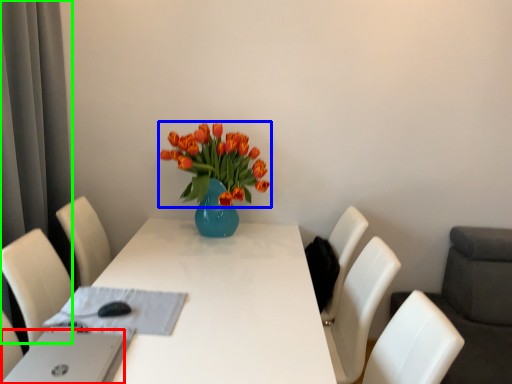
Question: Estimate the real-world distances between objects in this image. Which object is closer to computer (highlighted by a red box), flower (highlighted by a blue box) or curtain (highlighted by a green box)?

Choices:
 (A) flower
 (B) curtain

Answer: (A)